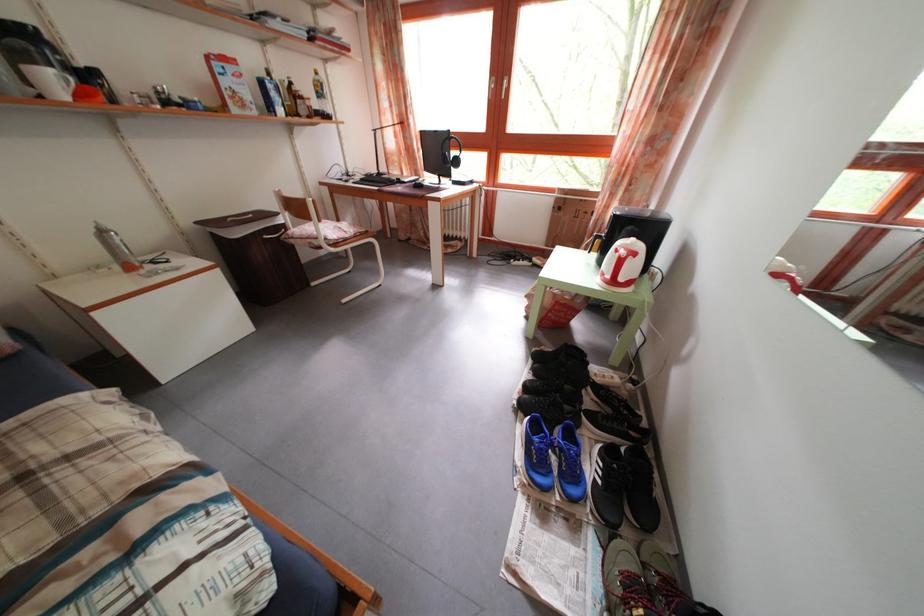
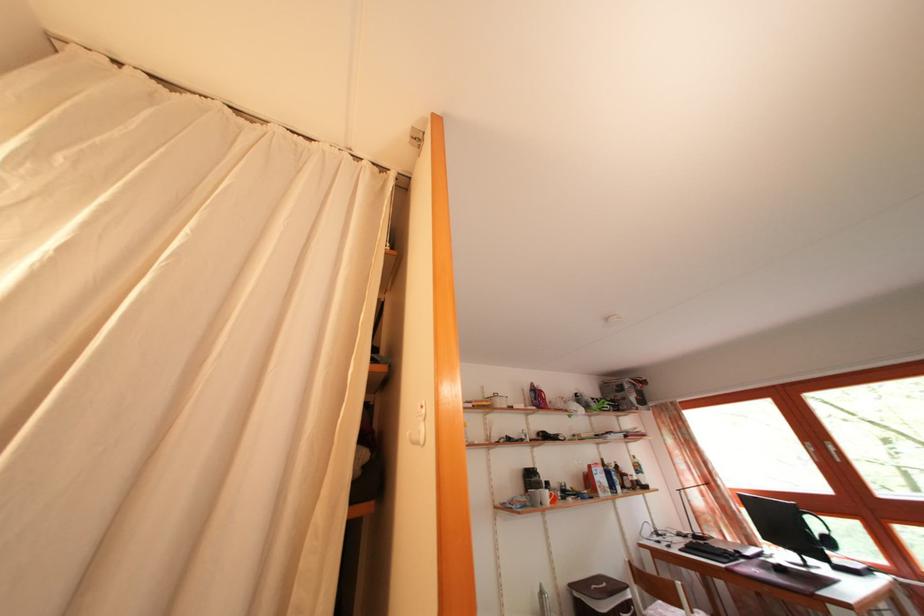
The point at (312, 102) is marked in the first image. Where is the corresponding point in the second image?

(636, 480)